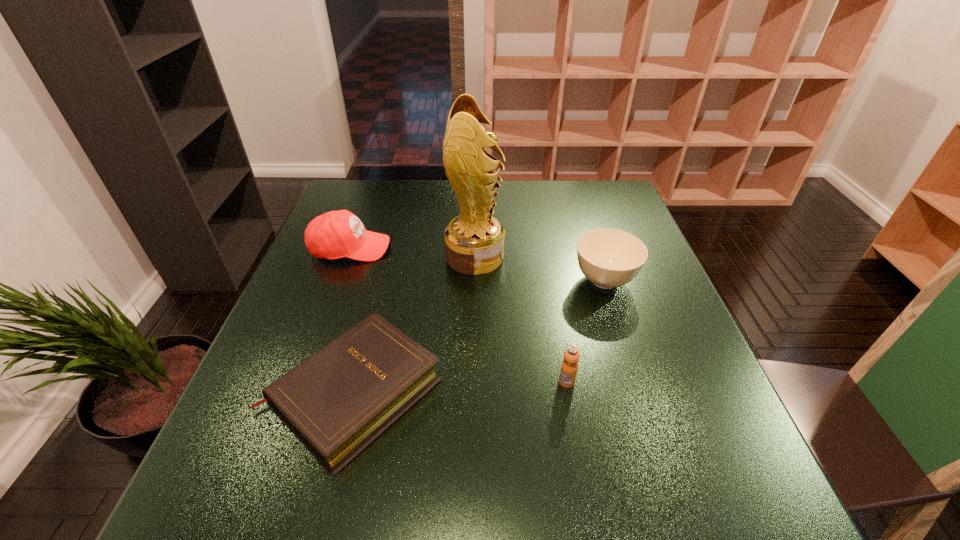
I want to click on vacant area between the baseball cap and the orange juice, so 459,315.

Image resolution: width=960 pixels, height=540 pixels. In order to click on free space between the Bible and the sugar bowl in this screenshot , I will do `click(479, 336)`.

Find the location of a particular element. The height and width of the screenshot is (540, 960). vacant point located between the shortest object and the second object from right to left is located at coordinates 461,387.

Find the location of `unoccupied position between the award and the sugar bowl`. unoccupied position between the award and the sugar bowl is located at coordinates (540, 268).

At what (x,y) coordinates should I click in order to perform the action: click on free space between the rightmost object and the tallest object. Please return your answer as a coordinate pair (x, y). The image size is (960, 540). Looking at the image, I should click on (540, 268).

This screenshot has width=960, height=540. Identify the location of free space between the award and the baseball cap. (413, 252).

You are a GUI agent. You are given a task and a screenshot of the screen. Output one action in this format:
    pyautogui.click(x=<x>, y=<y>)
    Task: Click on the empty space between the orange juice and the baseball cap
    The height and width of the screenshot is (540, 960).
    Given the screenshot: What is the action you would take?
    [x=459, y=315]

Identify the location of vacant area that lies between the tallest object and the Bible. Image resolution: width=960 pixels, height=540 pixels. (415, 325).

Select which object appears as the second closest to the rightmost object. Please provide its 2D coordinates. Your answer should be formatted as a tuple, i.e. [(x, y)], where the tuple contains the x and y coordinates of a point satisfying the conditions above.

[(569, 367)]

Locate an element on the screen. This screenshot has height=540, width=960. the fourth closest object to the shortest object is located at coordinates (609, 258).